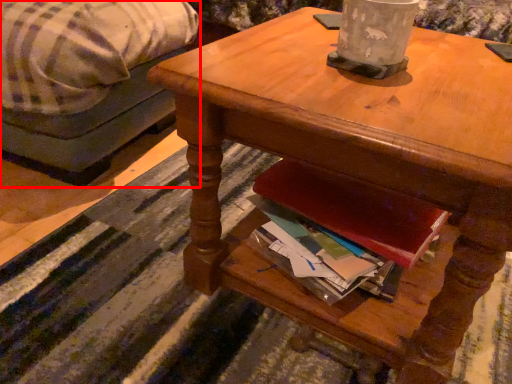
Question: From the image's perspective, what is the correct spatial relationship of studio couch (annotated by the red box) in relation to desk?

Choices:
 (A) above
 (B) below

Answer: (A)